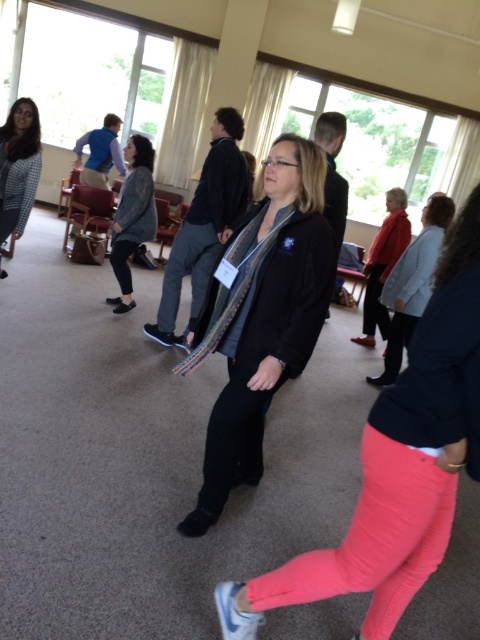
Question: Which point is closer to the camera?

Choices:
 (A) (275, 353)
 (B) (373, 275)
 (C) (472, 429)

Answer: (C)

Question: Does red sweater at right appear on the right side of matte black jacket at left?

Choices:
 (A) no
 (B) yes

Answer: (B)

Question: In this image, where is black matte jacket at center located relative to red sweater at right?

Choices:
 (A) right
 (B) left

Answer: (B)

Question: Which of the following is the farthest from the observer?

Choices:
 (A) (415, 492)
 (B) (9, 128)

Answer: (B)

Question: Is matte black jacket at center to the right of black matte jacket at center from the viewer's perspective?

Choices:
 (A) yes
 (B) no

Answer: (A)

Question: Estimate the real-world distances between objects in this image. Which object is closer to the red matte jacket at upper right?

Choices:
 (A) knitted gray sweater at center
 (B) matte black jacket at center
 (C) red sweater at right
 (D) black matte jacket at center

Answer: (C)